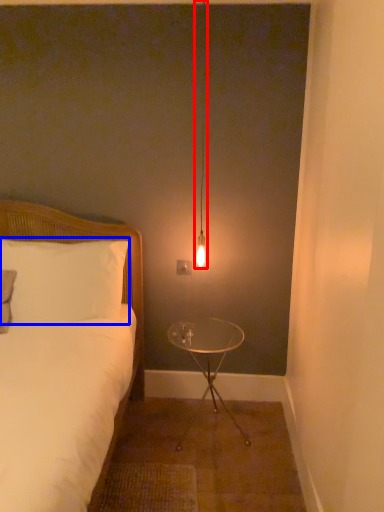
Question: Among these objects, which one is farthest to the camera, lamp (highlighted by a red box) or pillow (highlighted by a blue box)?

Choices:
 (A) lamp
 (B) pillow

Answer: (B)